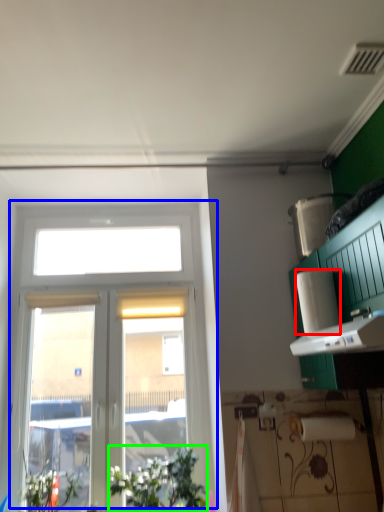
Question: Which object is positioned farthest from paper towel (highlighted by a red box)? Select from window (highlighted by a blue box) and plant (highlighted by a green box).

Choices:
 (A) window
 (B) plant

Answer: (A)